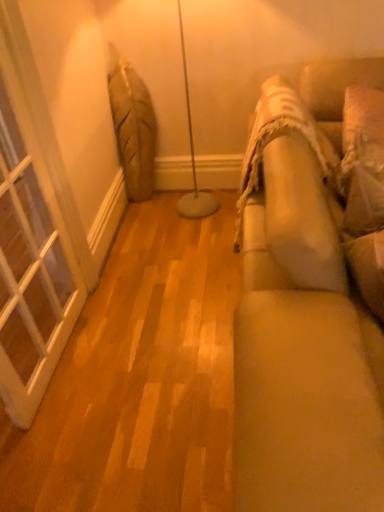
What are the coordinates of `white textured pillow at right` in the screenshot? It's located at tap(364, 184).

The image size is (384, 512). Find the location of `beige fabric couch at right`. beige fabric couch at right is located at coordinates (312, 296).

Where is `white textured pillow at right`? The image size is (384, 512). white textured pillow at right is located at coordinates (364, 184).

How many degrees apart are the facing directions of white glass window at left and white textured pillow at right?

8.89 degrees separate the facing orientations of white glass window at left and white textured pillow at right.

Which of these two, white glass window at left or white textured pillow at right, is wider?

white textured pillow at right.

Who is smaller, white glass window at left or white textured pillow at right?

white textured pillow at right.

Which of these two, white glass window at left or white textured pillow at right, stands taller?

Standing taller between the two is white glass window at left.

Looking at their sizes, would you say white glass window at left is wider or thinner than beige fabric couch at right?

white glass window at left is thinner than beige fabric couch at right.

Which object is further away from the camera, white glass window at left or beige fabric couch at right?

white glass window at left is more distant.

Is beige fabric couch at right at the back of white glass window at left?

No, white glass window at left's orientation is not away from beige fabric couch at right.

Locate an element on the screen. window behind the beige fabric couch at right is located at coordinates (29, 279).

From a real-world perspective, which object stands above the other?

white glass window at left, from a real-world perspective.

Between white textured pillow at right and white glass window at left, which one has smaller width?

white glass window at left is thinner.

How different are the orientations of white textured pillow at right and white glass window at left in degrees?

They differ by 8.89 degrees in their facing directions.

Can you confirm if white textured pillow at right is smaller than white glass window at left?

Correct, white textured pillow at right occupies less space than white glass window at left.

Considering the sizes of objects beige fabric couch at right and white glass window at left in the image provided, who is bigger, beige fabric couch at right or white glass window at left?

With larger size is beige fabric couch at right.

Does beige fabric couch at right have a lesser width compared to white glass window at left?

No.

Is beige fabric couch at right situated inside white glass window at left or outside?

beige fabric couch at right is outside white glass window at left.

Is point (364, 172) closer to camera compared to point (362, 492)?

No.

Considering the sizes of white textured pillow at right and beige fabric couch at right in the image, is white textured pillow at right wider or thinner than beige fabric couch at right?

Clearly, white textured pillow at right has less width compared to beige fabric couch at right.

From a real-world perspective, is white textured pillow at right positioned above or below beige fabric couch at right?

white textured pillow at right is situated higher than beige fabric couch at right in the real world.

Is the surface of white textured pillow at right in direct contact with beige fabric couch at right?

No, white textured pillow at right is not next to beige fabric couch at right.

Looking at this image, from a real-world perspective, relative to white textured pillow at right, is beige fabric couch at right vertically above or below?

beige fabric couch at right is situated lower than white textured pillow at right in the real world.

Considering the positions of points (367, 275) and (356, 214), is point (367, 275) closer to camera compared to point (356, 214)?

Yes, point (367, 275) is in front of point (356, 214).

Can you tell me how much beige fabric couch at right and white textured pillow at right differ in facing direction?

They differ by 8.9 degrees in their facing directions.

You are a GUI agent. You are given a task and a screenshot of the screen. Output one action in this format:
    pyautogui.click(x=<x>, y=<y>)
    Task: Click on the window on the left of white textured pillow at right
    
    Given the screenshot: What is the action you would take?
    pyautogui.click(x=29, y=279)

You are a GUI agent. You are given a task and a screenshot of the screen. Output one action in this format:
    pyautogui.click(x=<x>, y=<y>)
    Task: Click on the window above the beige fabric couch at right (from a real-world perspective)
    The height and width of the screenshot is (512, 384).
    Given the screenshot: What is the action you would take?
    pyautogui.click(x=29, y=279)

Consider the image. Which object lies nearer to the anchor point white textured pillow at right, white glass window at left or beige fabric couch at right?

beige fabric couch at right is positioned closer to the anchor white textured pillow at right.

Based on their spatial positions, is white glass window at left or white textured pillow at right closer to beige fabric couch at right?

white textured pillow at right is closer to beige fabric couch at right.

From the image, which object appears to be farther from beige fabric couch at right, white textured pillow at right or white glass window at left?

white glass window at left is positioned further to the anchor beige fabric couch at right.

Estimate the real-world distances between objects in this image. Which object is further from white textured pillow at right, beige fabric couch at right or white glass window at left?

The object further to white textured pillow at right is white glass window at left.

Based on the photo, from the image, which object appears to be nearer to white glass window at left, beige fabric couch at right or white textured pillow at right?

The object closer to white glass window at left is beige fabric couch at right.

From the image, which object appears to be farther from white glass window at left, white textured pillow at right or beige fabric couch at right?

white textured pillow at right is positioned further to the anchor white glass window at left.

Find the location of `studio couch between white glass window at left and white textured pillow at right`. studio couch between white glass window at left and white textured pillow at right is located at coordinates (312, 296).